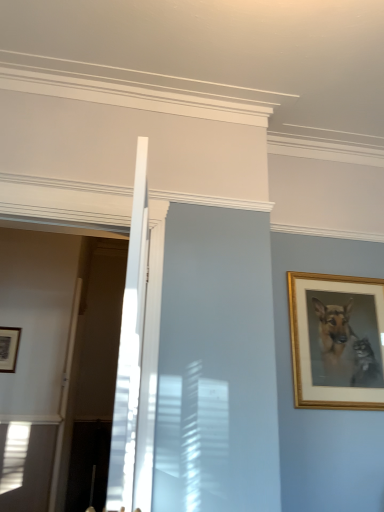
Question: From the image's perspective, is gold/golden frame at right, arranged as the second picture frame when viewed from the back, above or below matte black picture frame at lower left, the 1th picture frame viewed from the back?

Choices:
 (A) below
 (B) above

Answer: (B)

Question: Considering the positions of gold/golden frame at right, which ranks as the first picture frame in right-to-left order, and matte black picture frame at lower left, the first picture frame from the left, in the image, is gold/golden frame at right, which ranks as the first picture frame in right-to-left order, taller or shorter than matte black picture frame at lower left, the first picture frame from the left,?

Choices:
 (A) short
 (B) tall

Answer: (B)

Question: Which is correct: gold/golden frame at right, which ranks as the first picture frame in right-to-left order, is inside matte black picture frame at lower left, the 1th picture frame viewed from the back, or outside of it?

Choices:
 (A) inside
 (B) outside

Answer: (B)

Question: From a real-world perspective, relative to gold/golden frame at right, which ranks as the first picture frame in right-to-left order, is matte black picture frame at lower left, the first picture frame from the left, vertically above or below?

Choices:
 (A) below
 (B) above

Answer: (A)

Question: From the image's perspective, is matte black picture frame at lower left, which is the 2th picture frame in right-to-left order, located above or below gold/golden frame at right, which ranks as the first picture frame in right-to-left order?

Choices:
 (A) above
 (B) below

Answer: (B)

Question: Looking at their shapes, would you say matte black picture frame at lower left, the 1th picture frame viewed from the back, is wider or thinner than gold/golden frame at right, arranged as the second picture frame when viewed from the back?

Choices:
 (A) thin
 (B) wide

Answer: (A)

Question: In terms of height, does matte black picture frame at lower left, which is counted as the second picture frame, starting from the front, look taller or shorter compared to gold/golden frame at right, placed as the 1th picture frame when sorted from front to back?

Choices:
 (A) tall
 (B) short

Answer: (B)